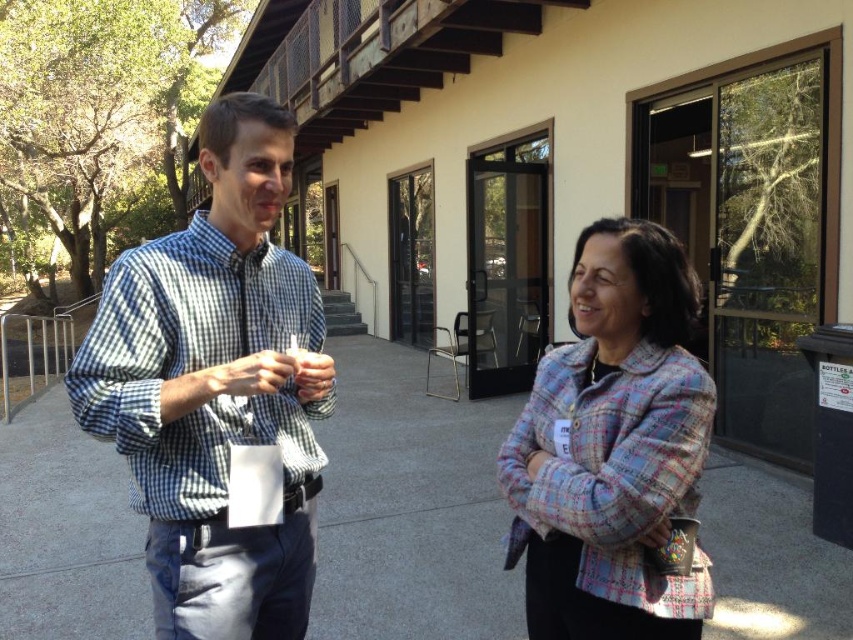
Can you confirm if blue checkered shirt at left is thinner than checkered fabric shirt at left?

Yes.

This screenshot has height=640, width=853. Describe the element at coordinates (613, 449) in the screenshot. I see `blue checkered shirt at left` at that location.

Identify the location of blue checkered shirt at left. (613, 449).

Does checkered fabric shirt at left have a greater height compared to plaid fabric jacket at center?

Indeed, checkered fabric shirt at left has a greater height compared to plaid fabric jacket at center.

Does point (207, 170) come in front of point (612, 436)?

No, it is not.

What do you see at coordinates (216, 387) in the screenshot?
I see `checkered fabric shirt at left` at bounding box center [216, 387].

At what (x,y) coordinates should I click in order to perform the action: click on checkered fabric shirt at left. Please return your answer as a coordinate pair (x, y). Looking at the image, I should click on (216, 387).

Between point (263, 108) and point (646, 625), which one is positioned in front?

Point (646, 625) is in front.

Between blue checkered shirt at left and plaid fabric jacket at center, which one is positioned lower?

Positioned lower is blue checkered shirt at left.

Does point (231, 424) come behind point (676, 598)?

Yes, point (231, 424) is farther from viewer.

At what (x,y) coordinates should I click in order to perform the action: click on blue checkered shirt at left. Please return your answer as a coordinate pair (x, y). The width and height of the screenshot is (853, 640). Looking at the image, I should click on (613, 449).